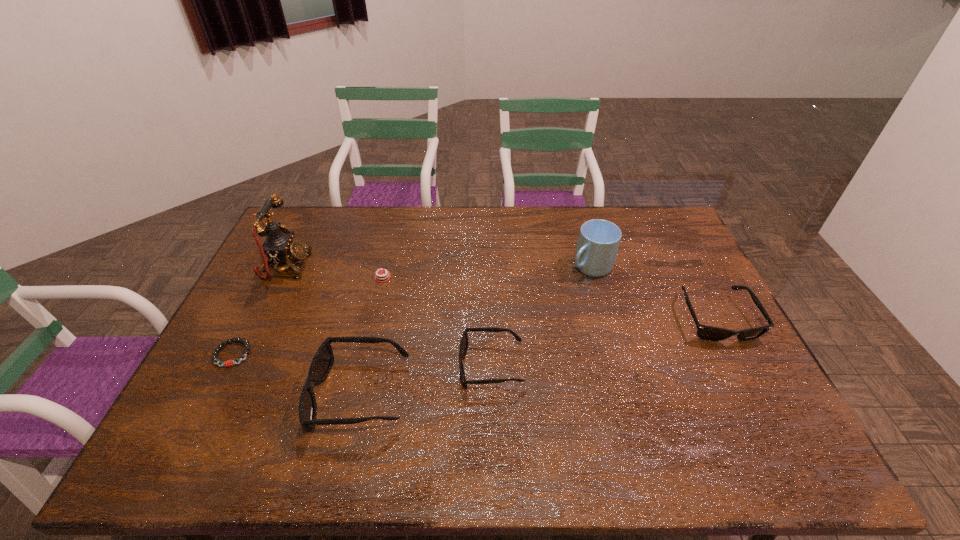
Locate an element on the screen. Image resolution: width=960 pixels, height=540 pixels. vacant point located on the front of the sixth tallest object is located at coordinates (354, 399).

At what (x,y) coordinates should I click in order to perform the action: click on telephone that is at the left edge. Please return your answer as a coordinate pair (x, y). The width and height of the screenshot is (960, 540). Looking at the image, I should click on (279, 247).

Where is `bracelet positioned at the left edge`? The width and height of the screenshot is (960, 540). bracelet positioned at the left edge is located at coordinates (228, 363).

Where is `object that is positioned at the right edge`? This screenshot has width=960, height=540. object that is positioned at the right edge is located at coordinates (709, 333).

The width and height of the screenshot is (960, 540). In the image, there is a desktop. What are the coordinates of `free region at the far edge` in the screenshot? It's located at (562, 212).

In the image, there is a desktop. At what (x,y) coordinates should I click in order to perform the action: click on vacant space at the near edge. Please return your answer as a coordinate pair (x, y). Looking at the image, I should click on (276, 415).

Where is `free region at the left edge of the desktop`? The width and height of the screenshot is (960, 540). free region at the left edge of the desktop is located at coordinates (x=229, y=334).

The width and height of the screenshot is (960, 540). In the image, there is a desktop. In order to click on vacant space at the far left corner in this screenshot , I will do `click(321, 215)`.

In the image, there is a desktop. Where is `vacant space at the near left corner`? This screenshot has height=540, width=960. vacant space at the near left corner is located at coordinates (250, 407).

Find the location of a particular element. The height and width of the screenshot is (540, 960). free space at the far right corner of the desktop is located at coordinates (660, 226).